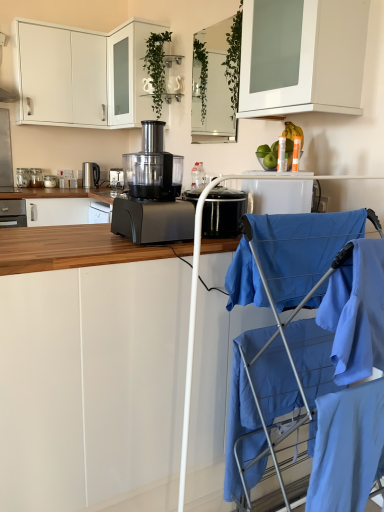
Find the location of a particular element. This screenshot has height=512, width=384. vacant space in front of black plastic food processor at center, the fourth kitchen appliance viewed from the left is located at coordinates (93, 250).